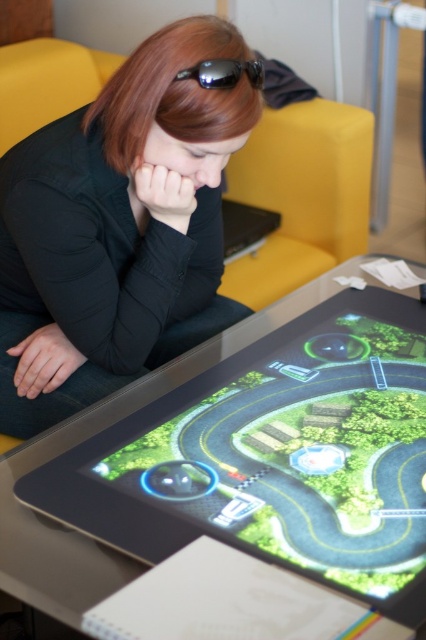
Can you confirm if green glossy tablet at center is taller than black matte shirt at center?

No.

The height and width of the screenshot is (640, 426). I want to click on green glossy tablet at center, so click(275, 456).

Locate an element on the screen. green glossy tablet at center is located at coordinates (275, 456).

Is point (14, 192) behind point (224, 65)?

Yes, point (14, 192) is behind point (224, 65).

Does point (101, 232) come closer to viewer compared to point (181, 70)?

No, (101, 232) is behind (181, 70).

Where is `black matte shirt at center`? This screenshot has width=426, height=640. black matte shirt at center is located at coordinates (118, 228).

From the picture: Who is more distant from viewer, (x=273, y=497) or (x=189, y=76)?

Point (x=189, y=76)

Identify the location of green glossy tablet at center. Image resolution: width=426 pixels, height=640 pixels. (275, 456).